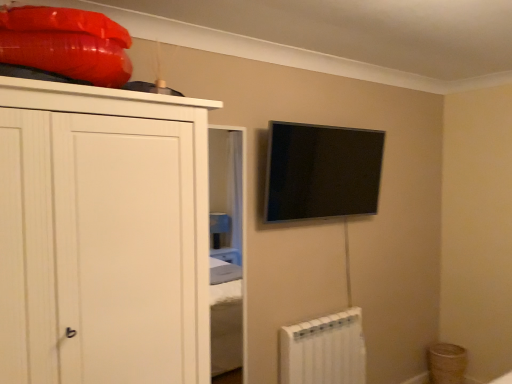
Locate an element on the screen. blank space situated above white plastic radiator at lower right (from a real-world perspective) is located at coordinates (320, 319).